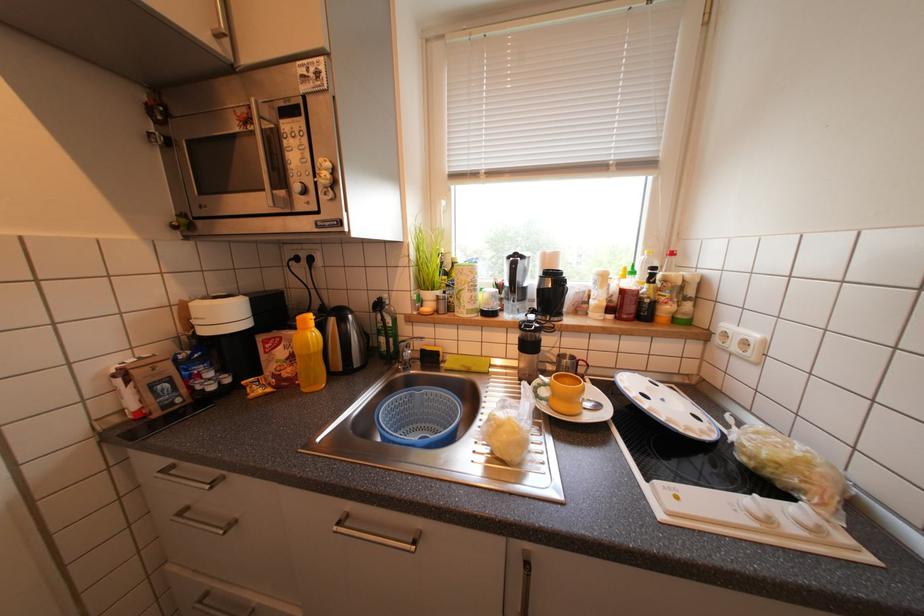
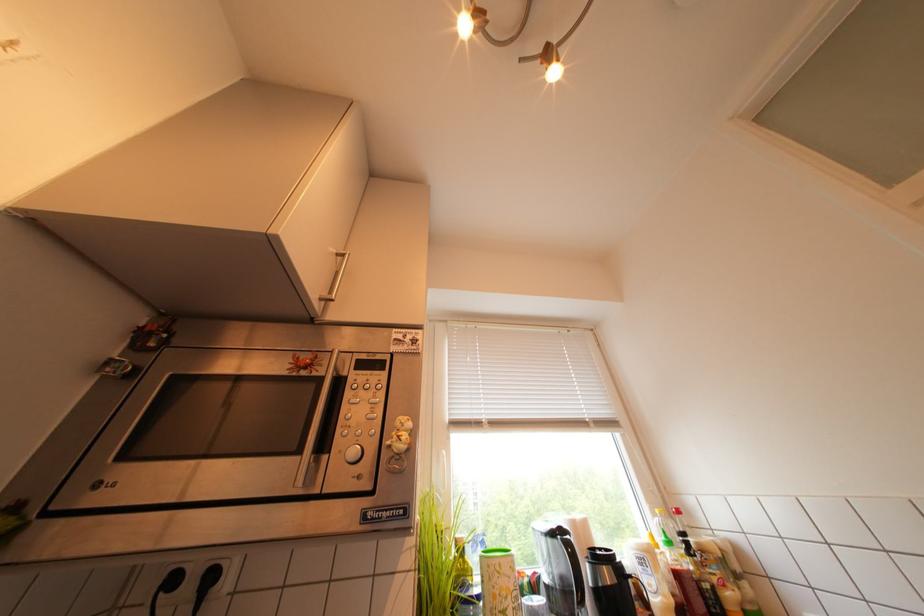
How did the camera likely rotate?

The rotation direction of the camera is right-up.